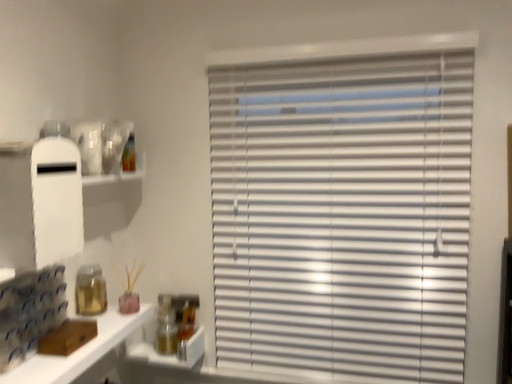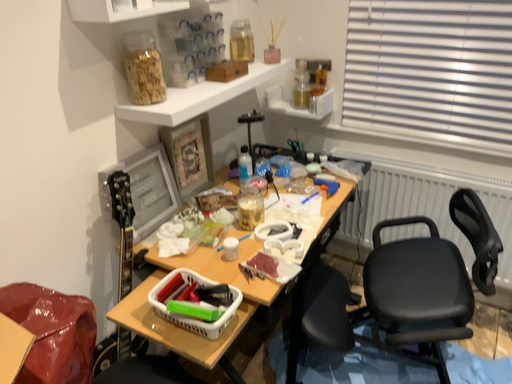
Question: Which way did the camera rotate in the video?

Choices:
 (A) rotated right
 (B) rotated left

Answer: (B)